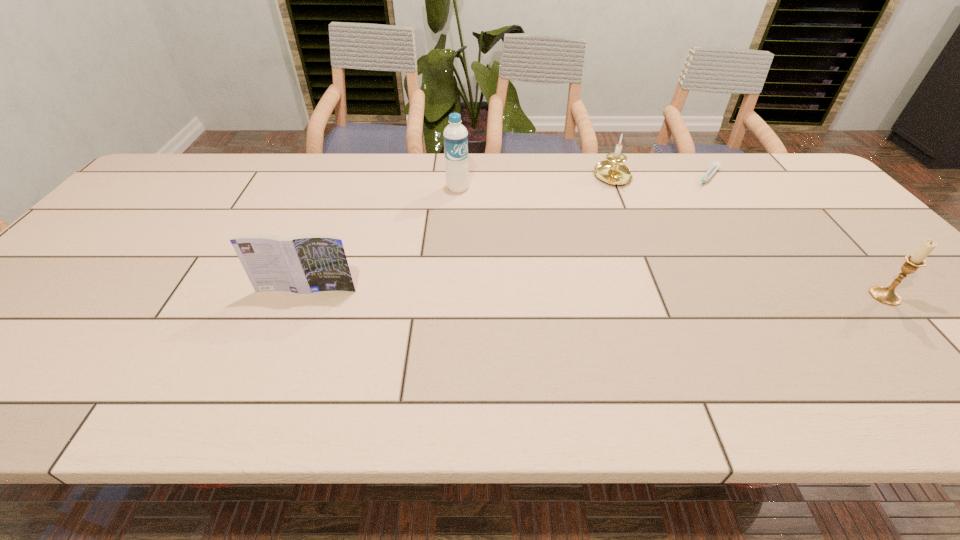
The width and height of the screenshot is (960, 540). Find the location of `water bottle that is at the far edge`. water bottle that is at the far edge is located at coordinates (455, 136).

Find the location of `syringe at the far edge`. syringe at the far edge is located at coordinates (715, 166).

Find the location of `candle holder present at the far edge`. candle holder present at the far edge is located at coordinates (612, 171).

The height and width of the screenshot is (540, 960). What are the coordinates of `object at the right edge` in the screenshot? It's located at (886, 295).

This screenshot has height=540, width=960. Find the location of `vacant space at the far edge of the desktop`. vacant space at the far edge of the desktop is located at coordinates (565, 186).

You are a GUI agent. You are given a task and a screenshot of the screen. Output one action in this format:
    pyautogui.click(x=<x>, y=<y>)
    Task: Click on the free region at the near edge of the desktop
    This screenshot has height=540, width=960.
    Given the screenshot: What is the action you would take?
    pyautogui.click(x=449, y=334)

Find the location of a particular element. The image size is (960, 540). vacant region at the left edge of the desktop is located at coordinates (108, 277).

Locate an element on the screen. The width and height of the screenshot is (960, 540). vacant space at the far left corner of the desktop is located at coordinates (203, 173).

What are the coordinates of `vacant space at the far right corner of the desktop` in the screenshot? It's located at (795, 163).

In the image, there is a desktop. Identify the location of vacant space at the near right corner. (937, 337).